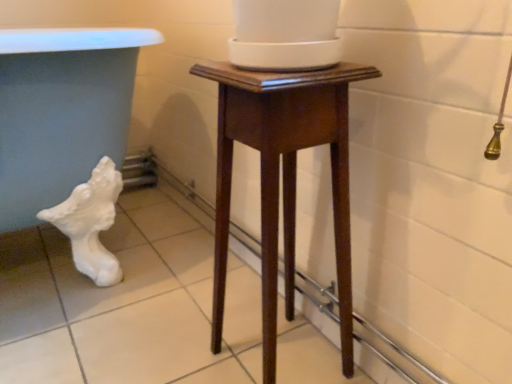
You are a GUI agent. You are given a task and a screenshot of the screen. Output one action in this format:
    pyautogui.click(x=<x>, y=<y>)
    Task: Click on the vacant space that is to the left of mahogany wood pedestal at center
    
    Given the screenshot: What is the action you would take?
    pyautogui.click(x=174, y=346)